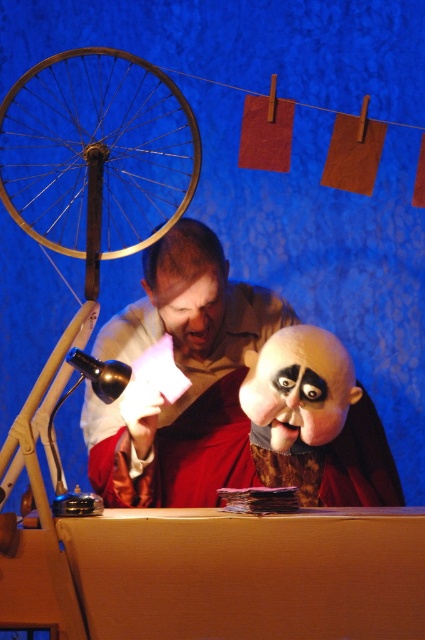
You are a stagehand preparing for a play. You need to ensure that the matte white shirt at center and the gold metallic bicycle wheel at left are visible to the audience. Based on their positions, which object might block the view of the other?

The gold metallic bicycle wheel at left is positioned above the matte white shirt at center, so it might block the view of the matte white shirt at center.

You are a stagehand in a puppet show and need to locate the matte white shirt at center. According to the coordinates provided, where should you look to find it?

The matte white shirt at center is located at point (186, 374).